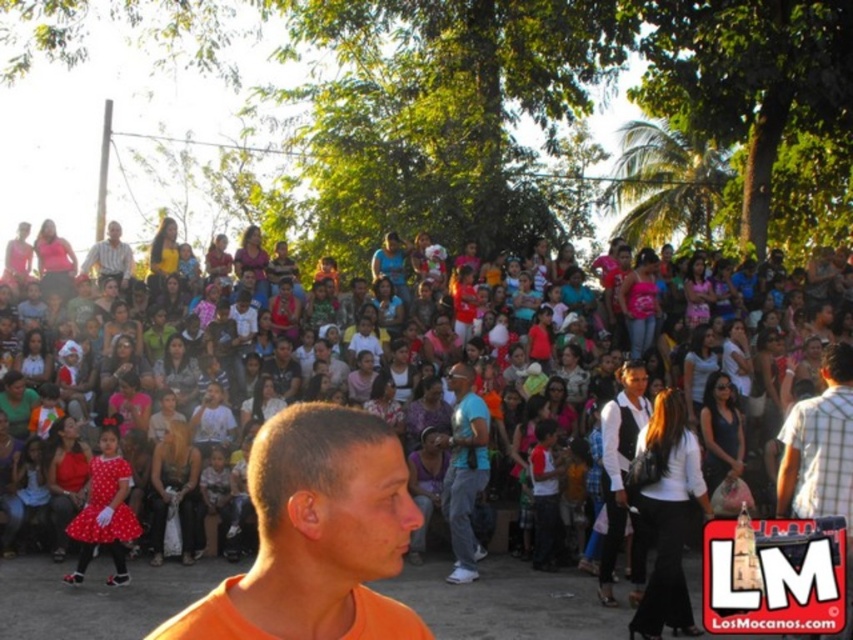
Who is positioned more to the left, matte pink dress at center or blue fabric shirt at center?

matte pink dress at center is more to the left.

Is matte pink dress at center wider than blue fabric shirt at center?

Yes, matte pink dress at center is wider than blue fabric shirt at center.

This screenshot has height=640, width=853. What are the coordinates of `matte pink dress at center` in the screenshot? It's located at (505, 600).

Does orange matte shirt at center have a lesser width compared to light brown shirt at center?

Yes.

Does orange matte shirt at center have a greater width compared to light brown shirt at center?

Incorrect, orange matte shirt at center's width does not surpass light brown shirt at center's.

Which is behind, point (335, 518) or point (786, 436)?

The point (786, 436) is more distant.

The height and width of the screenshot is (640, 853). I want to click on orange matte shirt at center, so click(x=316, y=536).

You are a GUI agent. You are given a task and a screenshot of the screen. Output one action in this format:
    pyautogui.click(x=<x>, y=<y>)
    Task: Click on the light brown shirt at center
    
    Given the screenshot: What is the action you would take?
    pyautogui.click(x=820, y=451)

Is light brown shirt at center smaller than blue fabric shirt at center?

No, light brown shirt at center is not smaller than blue fabric shirt at center.

Image resolution: width=853 pixels, height=640 pixels. What do you see at coordinates (820, 451) in the screenshot?
I see `light brown shirt at center` at bounding box center [820, 451].

Locate an element on the screen. light brown shirt at center is located at coordinates (820, 451).